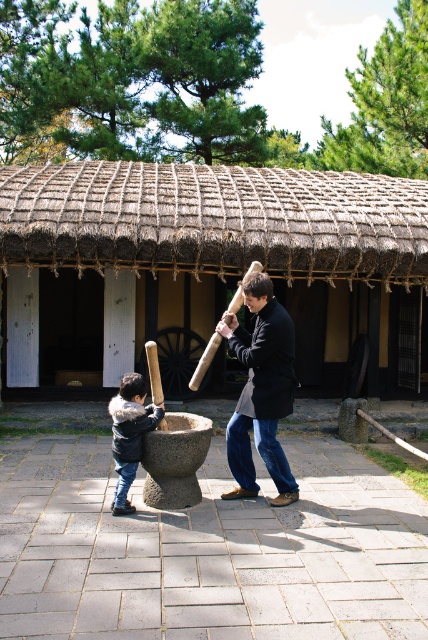
You are standing at point (195, 376) and want to walk to point (134, 433). Which direction should you move?

You should move forward because point (134, 433) is in front of point (195, 376).

You are a visitor at a traditional Korean village and see the smooth gray mortar at center and the wooden baseball bat at lower center. Which object is bigger in size?

The smooth gray mortar at center is larger in size compared to the wooden baseball bat at lower center.

You are standing in a traditional Korean outdoor setting. You see a thatched straw hut at center and a wooden baseball bat at lower center. Which object is taller?

The thatched straw hut at center is much taller than the wooden baseball bat at lower center.